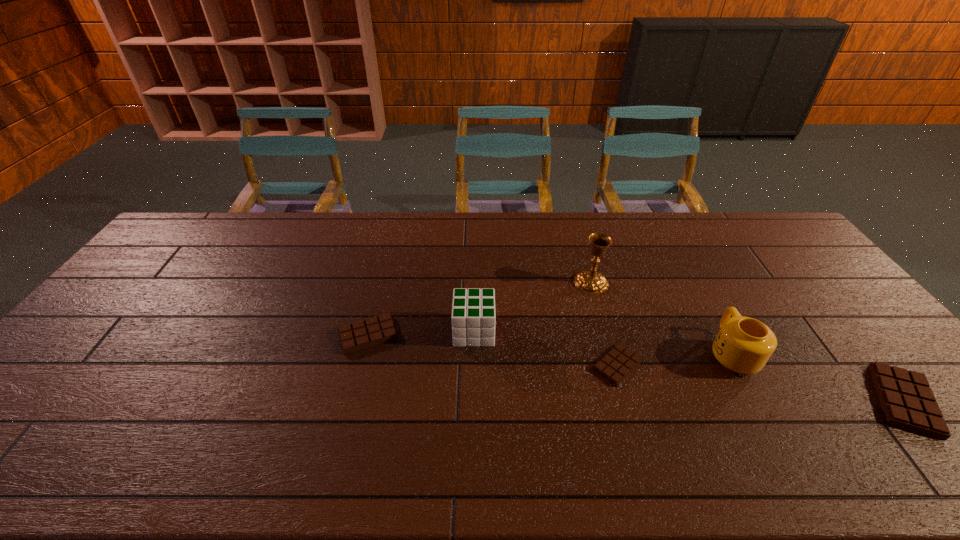
Where is `vacant region located on the right of the tallest object`? This screenshot has height=540, width=960. vacant region located on the right of the tallest object is located at coordinates (627, 282).

Identify the location of vacant point located on the red face of the fifth object from right to left. (547, 332).

Locate an element on the screen. vacant area located on the handle side of the mug is located at coordinates (693, 282).

The width and height of the screenshot is (960, 540). In order to click on vacant space located 0.150m on the handle side of the mug in this screenshot , I will do `click(699, 293)`.

Locate an element on the screen. The height and width of the screenshot is (540, 960). vacant position located 0.210m on the handle side of the mug is located at coordinates (691, 280).

What are the coordinates of `blank space at the far edge` in the screenshot? It's located at (238, 241).

The image size is (960, 540). I want to click on vacant area at the near edge of the desktop, so click(583, 416).

Identify the location of vacant space at the left edge of the desktop. The image size is (960, 540). (142, 329).

At what (x,y) coordinates should I click in order to perform the action: click on free space at the right edge of the desktop. Please return your answer as a coordinate pair (x, y). This screenshot has height=540, width=960. Looking at the image, I should click on (862, 332).

Identify the location of vacant space at the far left corner of the desktop. (223, 217).